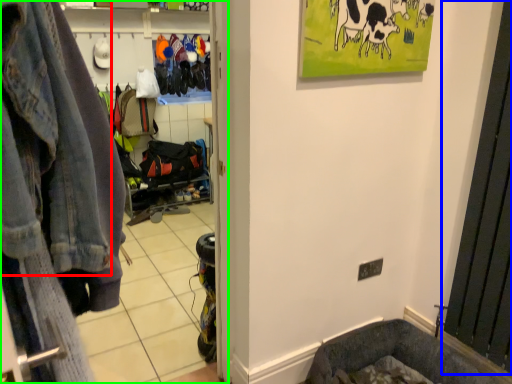
Question: Which object is the closest to the denim jacket (highlighted by a red box)? Choose among these: screen door (highlighted by a blue box) or clothing store (highlighted by a green box).

Choices:
 (A) screen door
 (B) clothing store

Answer: (B)